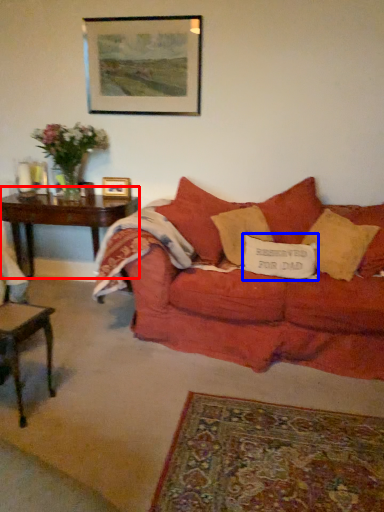
Question: Which point is further to the camera, table (highlighted by a red box) or pillow (highlighted by a blue box)?

Choices:
 (A) table
 (B) pillow

Answer: (A)